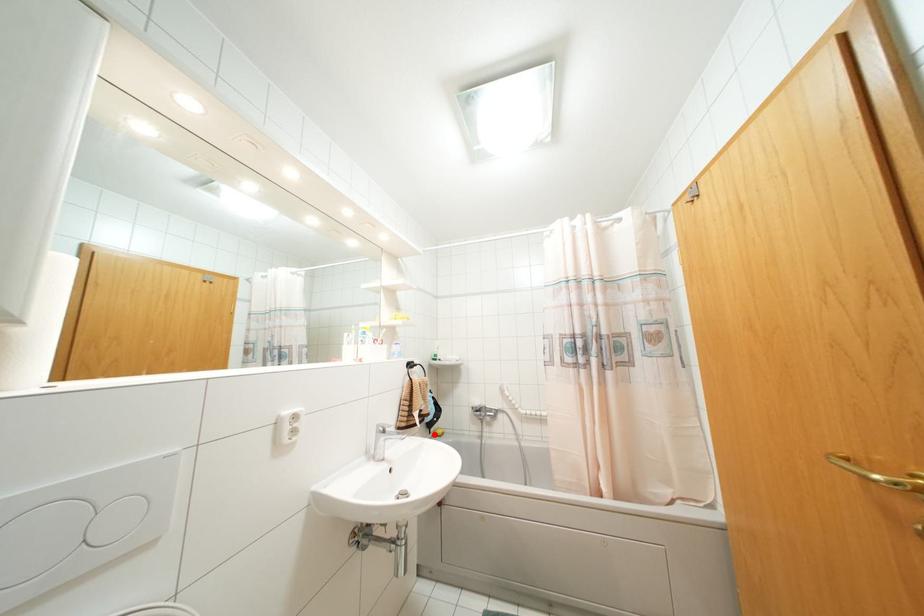
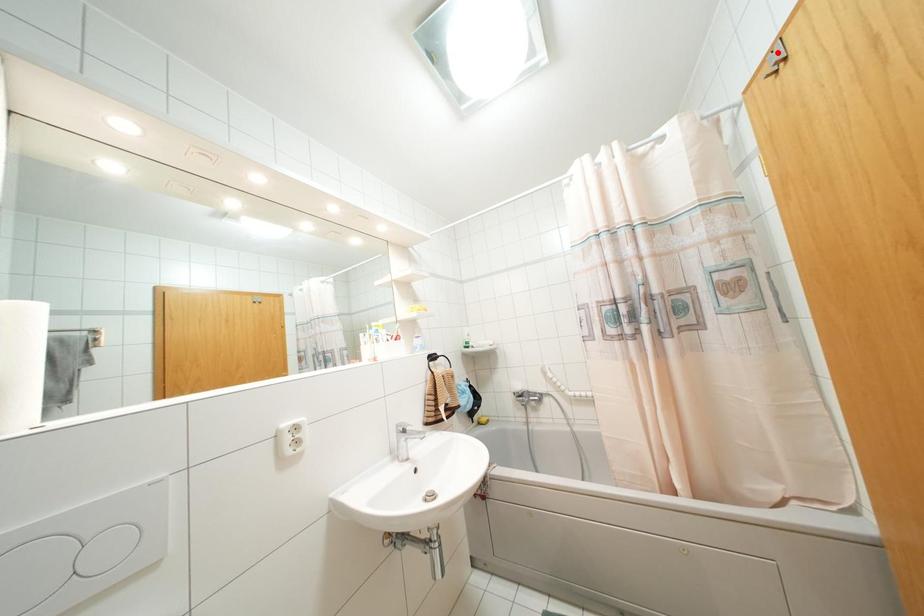
I am providing you with two images of the same scene from different viewpoints. A red point is marked on the first image and another point is marked on the second image. Are the points marked in image1 and image2 representing the same 3D position?

No